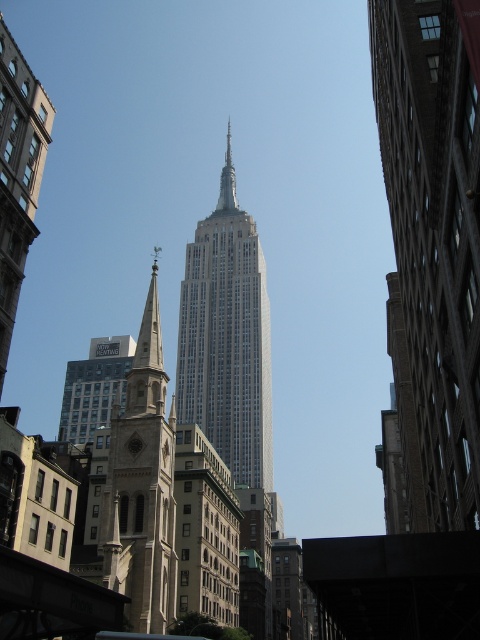
Question: Which object is farther from the camera taking this photo?

Choices:
 (A) smooth stone tower at center
 (B) silver metallic spire at center
 (C) white glass skyscraper at center
 (D) smooth stone tower at left

Answer: (B)

Question: Observing the image, what is the correct spatial positioning of smooth stone tower at center in reference to light brown stone church steeple at left?

Choices:
 (A) right
 (B) left

Answer: (A)

Question: Is smooth stone tower at center wider than silver metallic spire at center?

Choices:
 (A) yes
 (B) no

Answer: (A)

Question: Can you confirm if smooth stone tower at center is bigger than white glass skyscraper at center?

Choices:
 (A) no
 (B) yes

Answer: (A)

Question: Which point appears farthest from the camera in this image?

Choices:
 (A) (442, 202)
 (B) (24, 131)
 (C) (227, 188)
 (D) (132, 394)

Answer: (C)

Question: Based on their relative distances, which object is nearer to the light brown stone church steeple at left?

Choices:
 (A) smooth stone tower at left
 (B) silver metallic spire at center
 (C) smooth stone tower at center

Answer: (A)